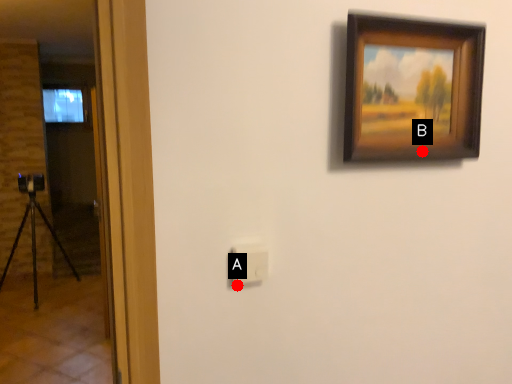
Question: Two points are circled on the image, labeled by A and B beside each circle. Which of the following is the closest to the observer?

Choices:
 (A) A is closer
 (B) B is closer

Answer: (A)